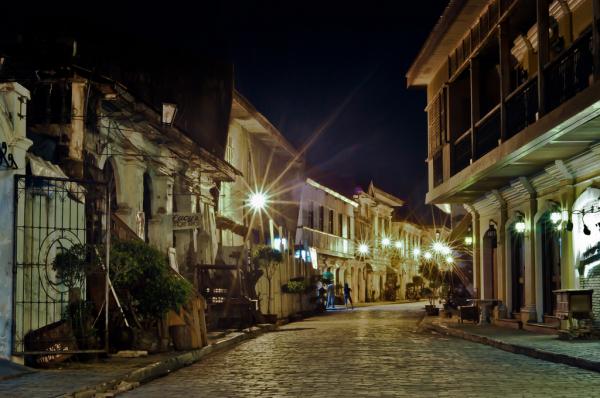
Locate an element on the screen. wooden structure is located at coordinates (573, 336).